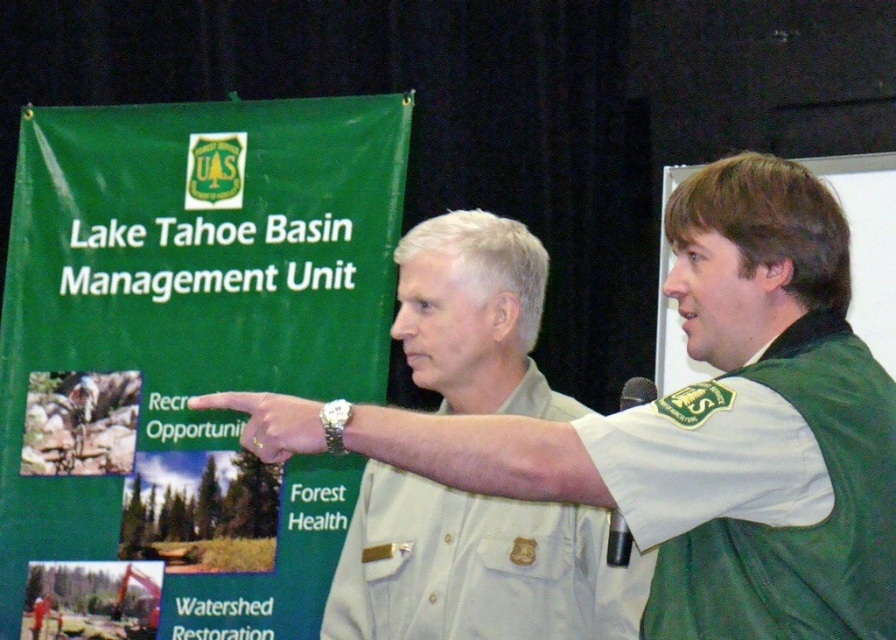
Who is positioned more to the left, green uniform at center or green fabric vest at right?

Positioned to the left is green uniform at center.

Is green uniform at center further to the viewer compared to green fabric vest at right?

No.

This screenshot has height=640, width=896. I want to click on green uniform at center, so click(x=718, y=428).

Is point (105, 113) closer to camera compared to point (672, 262)?

No.

Is green fabric poster at left above green fabric vest at right?

Actually, green fabric poster at left is below green fabric vest at right.

Between point (76, 362) and point (894, 266), which one is positioned behind?

The point (76, 362) is behind.

The height and width of the screenshot is (640, 896). In order to click on green fabric poster at left in this screenshot , I will do `click(186, 356)`.

Who is more forward, [298,625] or [265,444]?

Result: Point [265,444]

Is green fabric poster at left thinner than silver metallic watch at upper center?

Incorrect, green fabric poster at left's width is not less than silver metallic watch at upper center's.

Is point (375, 342) in front of point (274, 401)?

That is False.

Locate an element on the screen. The height and width of the screenshot is (640, 896). green fabric poster at left is located at coordinates pyautogui.click(x=186, y=356).